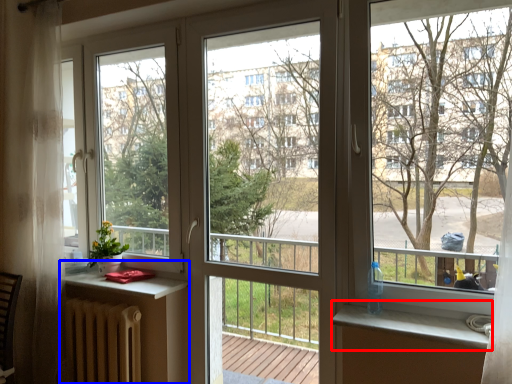
Question: Which object appears farthest to the camera in this image, window sill (highlighted by a red box) or table (highlighted by a blue box)?

Choices:
 (A) window sill
 (B) table

Answer: (B)